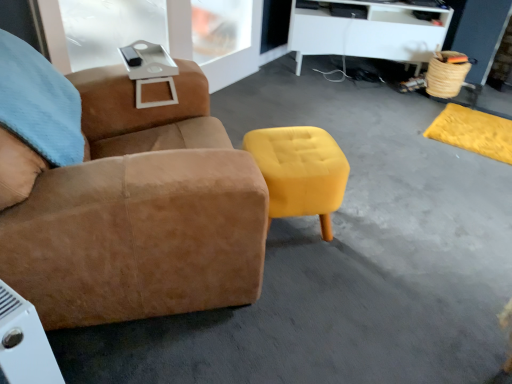
You are a GUI agent. You are given a task and a screenshot of the screen. Output one action in this format:
    pyautogui.click(x=<x>, y=<y>)
    Task: Click on the white matte desk at upper center
    
    Given the screenshot: What is the action you would take?
    pyautogui.click(x=367, y=32)

The image size is (512, 384). I want to click on suede brown chair at center, so click(128, 199).

This screenshot has width=512, height=384. What do you see at coordinates (128, 199) in the screenshot?
I see `suede brown chair at center` at bounding box center [128, 199].

The height and width of the screenshot is (384, 512). I want to click on white matte desk at upper center, so click(367, 32).

From a real-world perspective, is yellow suede ottoman at center over suede brown chair at center?

No, from a real-world perspective, yellow suede ottoman at center is not above suede brown chair at center.

Based on the photo, is yellow suede ottoman at center looking in the opposite direction of suede brown chair at center?

Yes, yellow suede ottoman at center is facing away from suede brown chair at center.

Between yellow suede ottoman at center and suede brown chair at center, which one has smaller size?

Smaller between the two is yellow suede ottoman at center.

Looking at this image, can you tell me how much yellow suede ottoman at center and suede brown chair at center differ in facing direction?

There is a 6.74-degree angle between the facing directions of yellow suede ottoman at center and suede brown chair at center.

Is yellow suede ottoman at center outside of white matte desk at upper center?

Absolutely, yellow suede ottoman at center is external to white matte desk at upper center.

Considering the sizes of objects yellow suede ottoman at center and white matte desk at upper center in the image provided, who is wider, yellow suede ottoman at center or white matte desk at upper center?

white matte desk at upper center.

Is point (320, 175) positioned in front of point (442, 11)?

That is True.

Which is in front, yellow suede ottoman at center or white matte desk at upper center?

yellow suede ottoman at center is in front.

From a real-world perspective, between white matte desk at upper center and yellow suede ottoman at center, who is vertically lower?

yellow suede ottoman at center.

Which object is wider, white matte desk at upper center or yellow suede ottoman at center?

white matte desk at upper center.

Is point (397, 35) positioned before point (269, 128)?

No, it is not.

From the image's perspective, is white matte desk at upper center over yellow suede ottoman at center?

Correct, white matte desk at upper center appears higher than yellow suede ottoman at center in the image.

From the image's perspective, is suede brown chair at center under yellow suede ottoman at center?

Incorrect, from the image's perspective, suede brown chair at center is higher than yellow suede ottoman at center.

Can you tell me how much suede brown chair at center and yellow suede ottoman at center differ in facing direction?

The facing directions of suede brown chair at center and yellow suede ottoman at center are 6.74 degrees apart.

Considering the relative positions of suede brown chair at center and yellow suede ottoman at center in the image provided, is suede brown chair at center to the right of yellow suede ottoman at center from the viewer's perspective?

No.

Are suede brown chair at center and yellow suede ottoman at center beside each other?

No, suede brown chair at center is not beside yellow suede ottoman at center.

From the image's perspective, which object appears higher, suede brown chair at center or white matte desk at upper center?

white matte desk at upper center, from the image's perspective.

Is suede brown chair at center further to camera compared to white matte desk at upper center?

No, the depth of suede brown chair at center is less than that of white matte desk at upper center.

Is suede brown chair at center placed right next to white matte desk at upper center?

There is a gap between suede brown chair at center and white matte desk at upper center.

Is suede brown chair at center taller than white matte desk at upper center?

Yes, suede brown chair at center is taller than white matte desk at upper center.

Is the position of white matte desk at upper center less distant than that of suede brown chair at center?

No, it is not.

Can you confirm if white matte desk at upper center is smaller than suede brown chair at center?

Yes.

Consider the image. Which of these two, white matte desk at upper center or suede brown chair at center, stands shorter?

white matte desk at upper center.

Is white matte desk at upper center facing away from suede brown chair at center?

That's not correct — white matte desk at upper center is not looking away from suede brown chair at center.

Where is `stool that is under the suede brown chair at center (from a real-world perspective)`? This screenshot has height=384, width=512. stool that is under the suede brown chair at center (from a real-world perspective) is located at coordinates (300, 171).

Locate an element on the screen. This screenshot has width=512, height=384. desk positioned vertically above the yellow suede ottoman at center (from a real-world perspective) is located at coordinates (367, 32).

Looking at the image, which one is located closer to yellow suede ottoman at center, suede brown chair at center or white matte desk at upper center?

suede brown chair at center.

Estimate the real-world distances between objects in this image. Which object is closer to suede brown chair at center, yellow suede ottoman at center or white matte desk at upper center?

yellow suede ottoman at center lies closer to suede brown chair at center than the other object.

Based on their spatial positions, is suede brown chair at center or yellow suede ottoman at center further from white matte desk at upper center?

The object further to white matte desk at upper center is suede brown chair at center.

Estimate the real-world distances between objects in this image. Which object is closer to white matte desk at upper center, yellow suede ottoman at center or suede brown chair at center?

Among the two, yellow suede ottoman at center is located nearer to white matte desk at upper center.

Considering their positions, is white matte desk at upper center positioned further to suede brown chair at center than yellow suede ottoman at center?

white matte desk at upper center lies further to suede brown chair at center than the other object.

From the picture: Considering their positions, is white matte desk at upper center positioned closer to yellow suede ottoman at center than suede brown chair at center?

The object closer to yellow suede ottoman at center is suede brown chair at center.

Where is `stool located between suede brown chair at center and white matte desk at upper center in the depth direction`? Image resolution: width=512 pixels, height=384 pixels. stool located between suede brown chair at center and white matte desk at upper center in the depth direction is located at coordinates (300, 171).